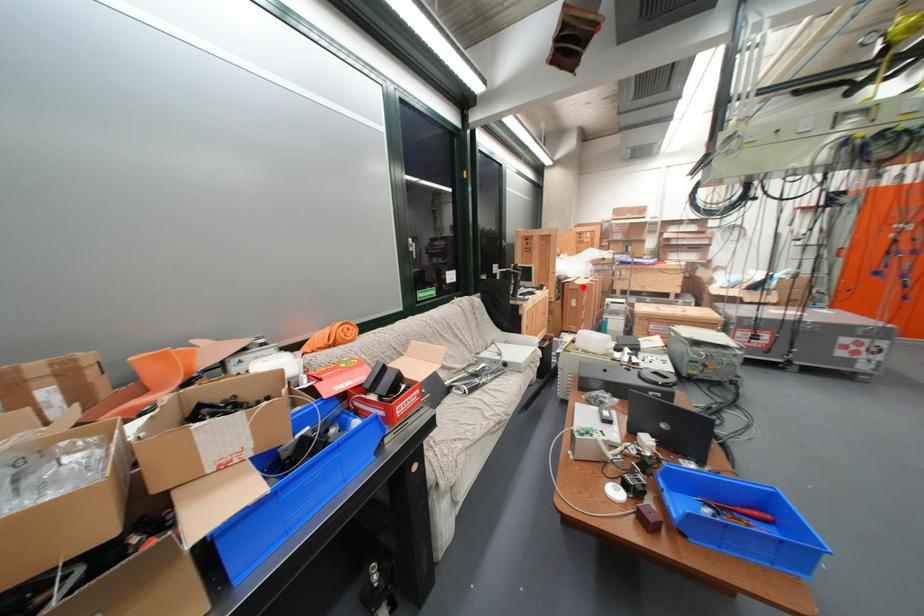
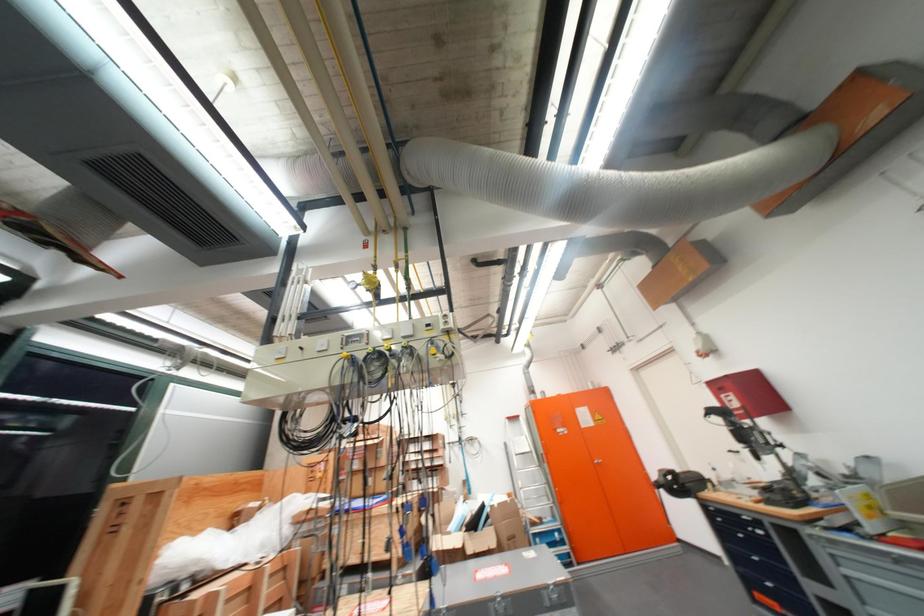
Question: I am providing you with two images of the same scene from different viewpoints. A red point is shown in image1. For the corresponding object point in image2, is it positioned nearer or farther from the camera?

Choices:
 (A) Nearer
 (B) Farther

Answer: (A)